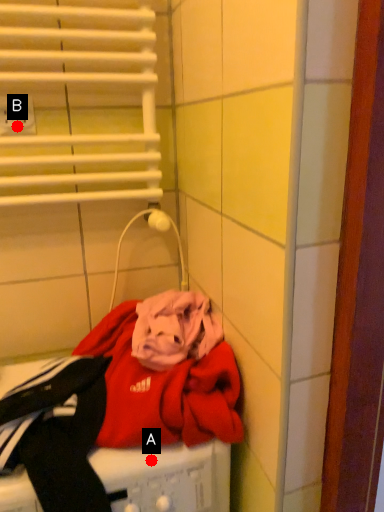
Question: Two points are circled on the image, labeled by A and B beside each circle. Which point is farther from the camera taking this photo?

Choices:
 (A) A is further
 (B) B is further

Answer: (B)